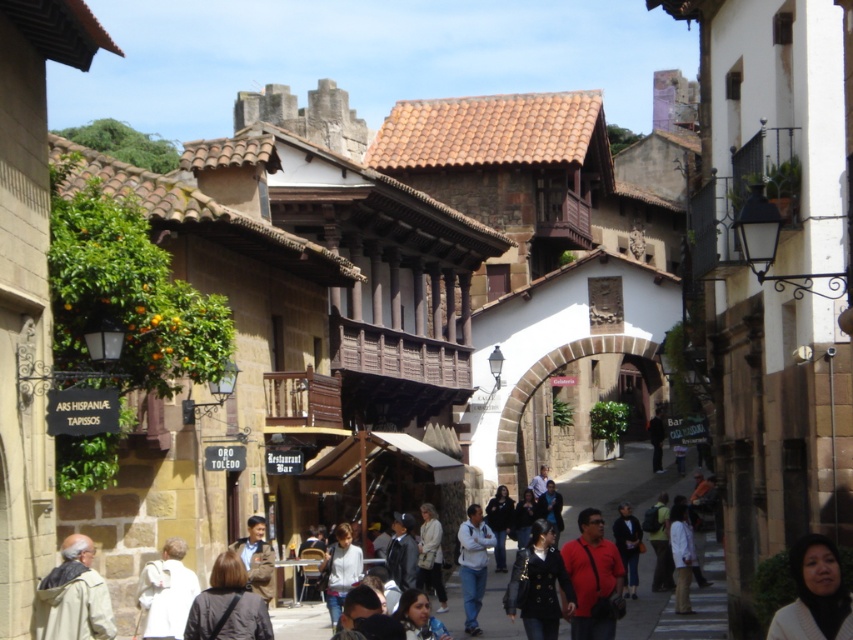
Does point (808, 554) come in front of point (433, 572)?

Yes, it is.

Who is lower down, smooth beige sweater at lower right or light beige sweater at center?

light beige sweater at center is lower down.

Is point (799, 637) positioned behind point (422, 550)?

That is False.

Locate an element on the screen. The width and height of the screenshot is (853, 640). smooth beige sweater at lower right is located at coordinates (814, 595).

In the scene shown: Is yellow-green jacket at center above dark blue jacket at center?

Yes, yellow-green jacket at center is above dark blue jacket at center.

Is yellow-green jacket at center closer to the viewer compared to dark blue jacket at center?

No, yellow-green jacket at center is further to the viewer.

Find the location of a particular element. yellow-green jacket at center is located at coordinates (659, 544).

At what (x,y) coordinates should I click in order to perform the action: click on yellow-green jacket at center. Please return your answer as a coordinate pair (x, y). The height and width of the screenshot is (640, 853). Looking at the image, I should click on [659, 544].

Based on the photo, which of these two, brown stone archway at center or dark blue jacket at center, stands shorter?

dark blue jacket at center is shorter.

Between point (512, 392) and point (636, 566), which one is positioned behind?

Point (512, 392)

At what (x,y) coordinates should I click in order to perform the action: click on brown stone archway at center. Please return your answer as a coordinate pair (x, y). The image size is (853, 640). Looking at the image, I should click on (543, 380).